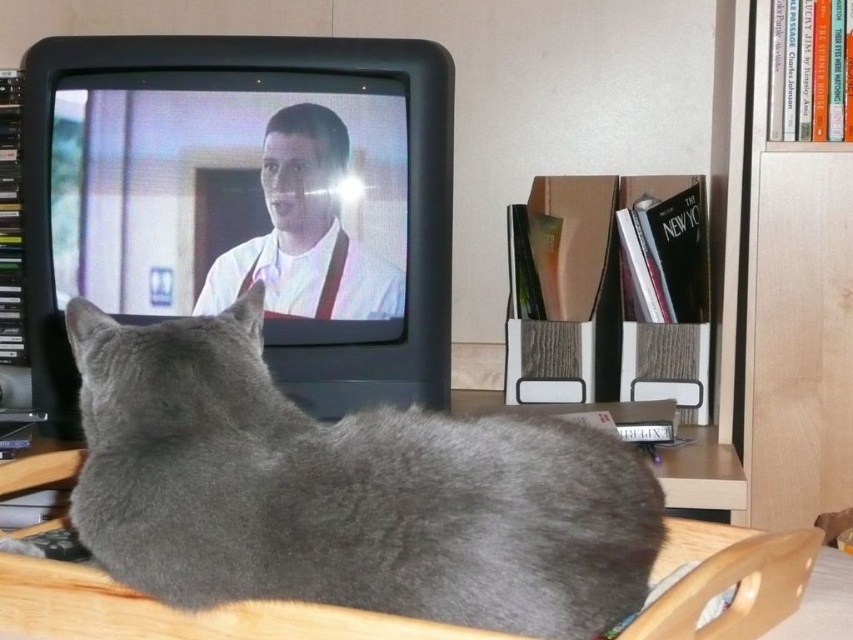
Between gray fur cat at center and light brown wood bookshelf at right, which one appears on the right side from the viewer's perspective?

From the viewer's perspective, light brown wood bookshelf at right appears more on the right side.

The width and height of the screenshot is (853, 640). I want to click on gray fur cat at center, so click(x=344, y=492).

Identify the location of gray fur cat at center. Image resolution: width=853 pixels, height=640 pixels. (344, 492).